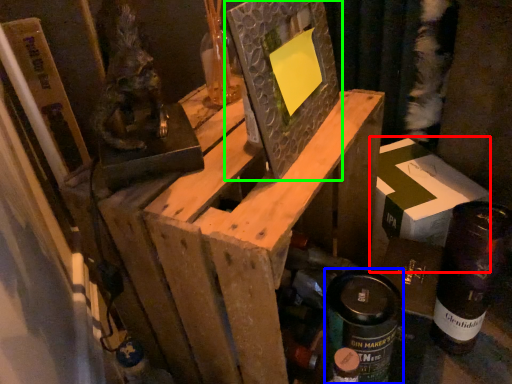
Question: Which object is positioned closest to cardboard box (highlighted by a red box)? Select from spray can (highlighted by a blue box) and picture frame (highlighted by a green box).

Choices:
 (A) spray can
 (B) picture frame

Answer: (A)